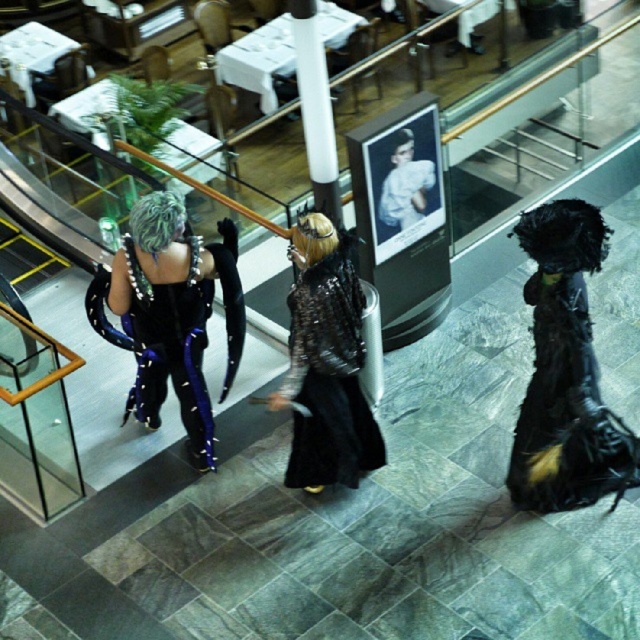
You are a photographer trying to capture a wide shot of the shiny black armor at left and the shiny silver wig at upper left. Which object should you focus on first if you want to ensure both are in frame without moving the camera?

You should focus on the shiny black armor at left first because its width is larger than the shiny silver wig at upper left, so centering it first will allow the smaller wig to fit into the frame more easily.

You are standing at the point labeled point (141, 241) and want to walk towards the point labeled point (300, 445). Given that the path between them is clear, will you be moving forward or backward relative to your current facing direction?

Since point (300, 445) is behind point (141, 241), you would be moving backward relative to your current facing direction.

You are a photographer trying to capture a photo of the shiny black armor at left and the shiny silver armor at center. Which armor should you focus on first if you want to include both in your frame without moving the camera?

You should focus on the shiny silver armor at center first because it is taller than the shiny black armor at left, allowing you to frame it properly while still capturing the shorter armor in the shot.